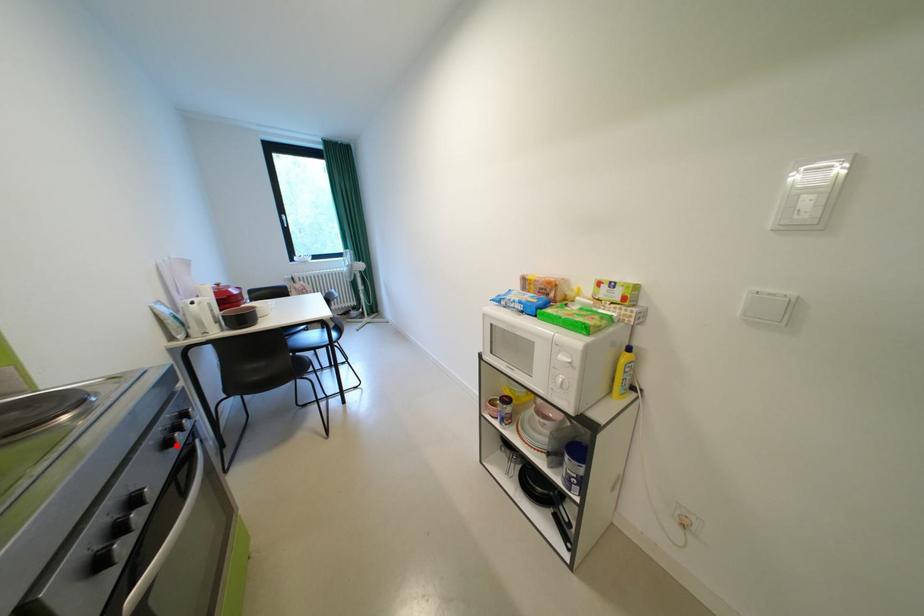
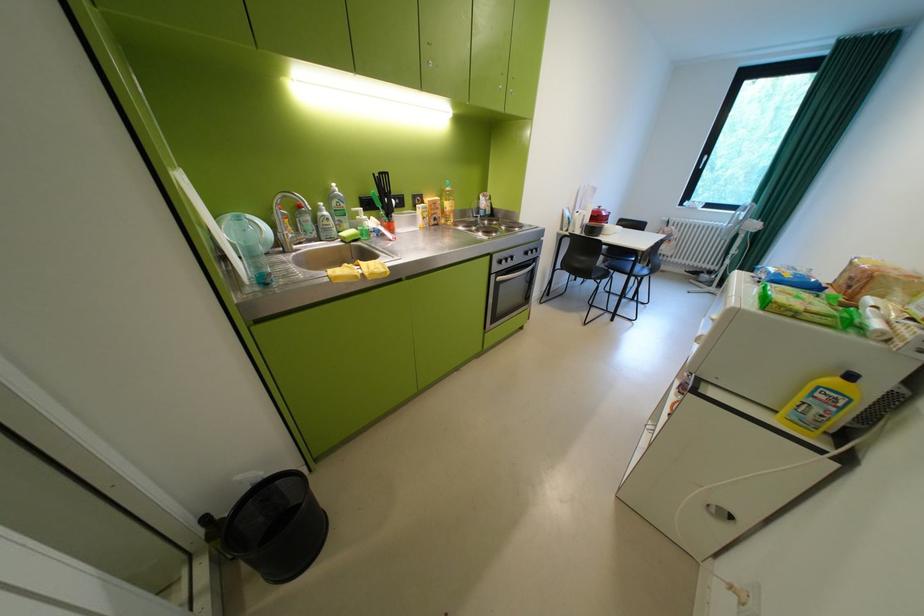
In the second image, find the point that corresponds to the highlighted location in the first image.

(537, 254)